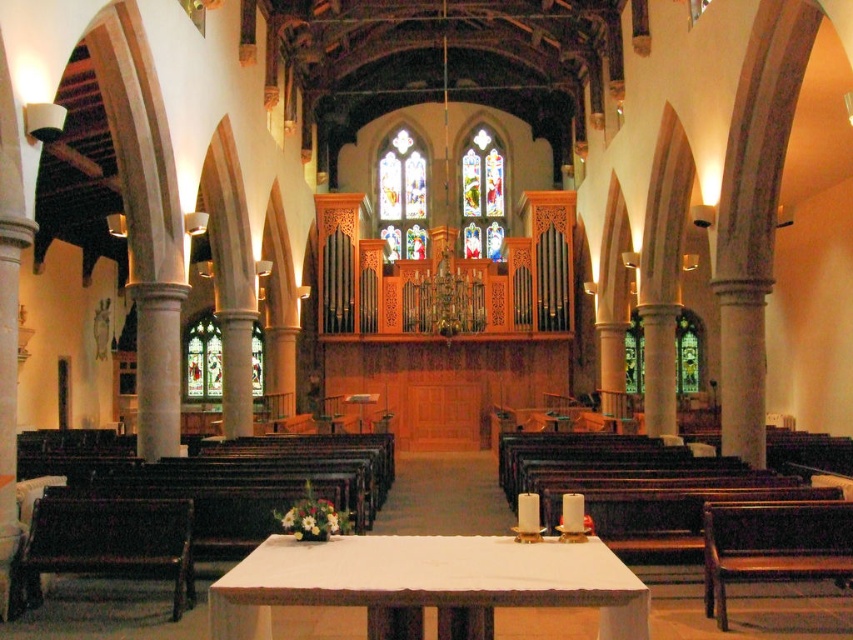
In the scene shown: Which of these two, stained glass at upper center or stained glass window at left, stands shorter?

stained glass window at left is shorter.

Does stained glass at upper center have a larger size compared to stained glass window at left?

No.

Who is more forward, (480, 237) or (210, 374)?

Point (210, 374) is in front.

At what (x,y) coordinates should I click in order to perform the action: click on stained glass at upper center. Please return your answer as a coordinate pair (x, y). The image size is (853, 640). Looking at the image, I should click on (482, 195).

Between point (595, 554) and point (120, 564), which one is positioned behind?

The point (120, 564) is more distant.

What do you see at coordinates (427, 582) in the screenshot?
I see `white cloth-covered table at center` at bounding box center [427, 582].

Locate an element on the screen. The height and width of the screenshot is (640, 853). white cloth-covered table at center is located at coordinates (427, 582).

Who is lower down, white cloth-covered table at center or stained glass window at left?

Positioned lower is white cloth-covered table at center.

Which is behind, point (368, 582) or point (189, 381)?

The point (189, 381) is behind.

Identify the location of white cloth-covered table at center. This screenshot has width=853, height=640. (427, 582).